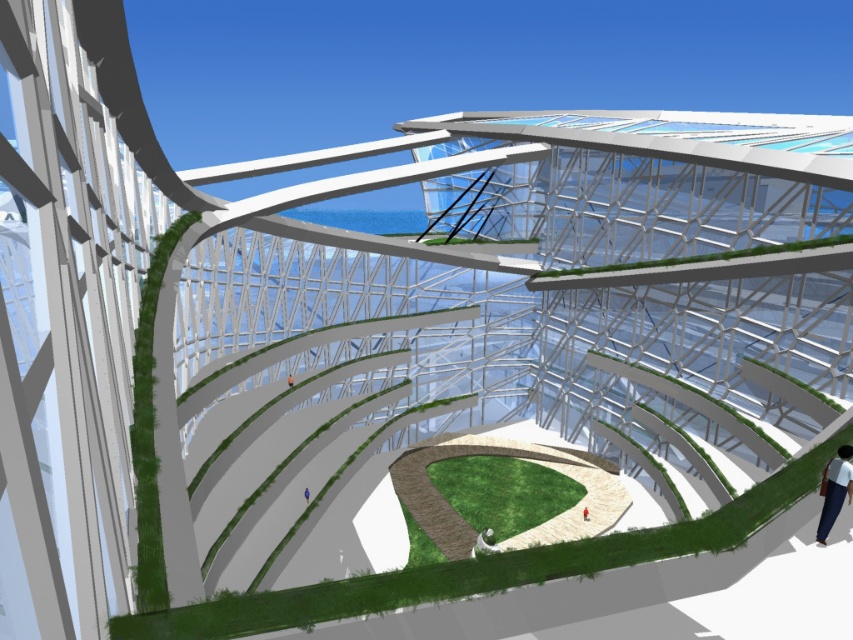
You are a visitor standing at the entrance of this futuristic building and you see the green grass at center and the white fabric pants at lower right. Which object is taller?

The green grass at center is taller than the white fabric pants at lower right according to the description provided.

You are standing at the entrance of the futuristic building and want to reach the white fabric pants at lower right. Which direction should you move from the green grass at center?

The green grass at center is to the left of white fabric pants at lower right, so to reach the white fabric pants at lower right from the green grass at center, you should move to the right.

You are an architect reviewing a digital model of a futuristic building. In the model, you see green grass at center and white fabric pants at lower right. Which object is located below the other?

The green grass at center is positioned under the white fabric pants at lower right.